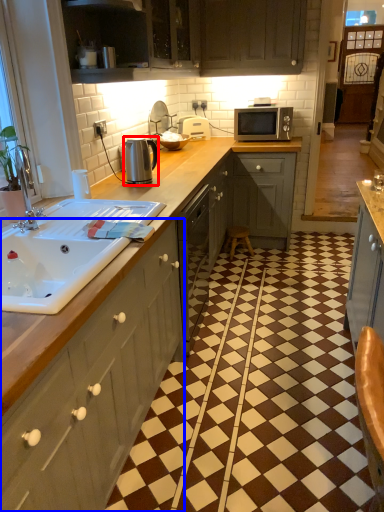
Question: Which object is further to the camera taking this photo, appliance (highlighted by a red box) or cabinetry (highlighted by a blue box)?

Choices:
 (A) appliance
 (B) cabinetry

Answer: (A)